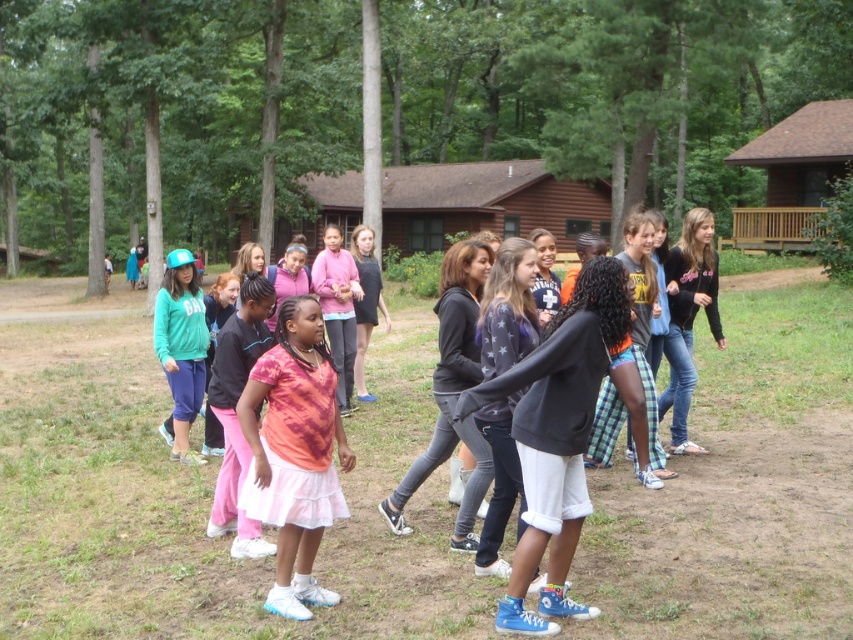
You are a photographer trying to capture both the brown wooden cabin at upper right and the pink fabric skirt at center in a single shot. Since you want to ensure both are visible, which object should you focus on first to account for their sizes?

The brown wooden cabin at upper right is bigger than the pink fabric skirt at center, so you should focus on the brown wooden cabin at upper right first to ensure it fits properly in the frame before adjusting for the smaller pink fabric skirt at center.

You are a photographer positioned at the edge of the campsite. You want to capture a photo that includes both the brown wooden cabin at upper right and the pink fabric skirt at center. Which object should you adjust your camera angle to focus on first to ensure both are in frame?

The brown wooden cabin at upper right is closer to you than the pink fabric skirt at center, so you should focus on the brown wooden cabin at upper right first to ensure both are in frame.